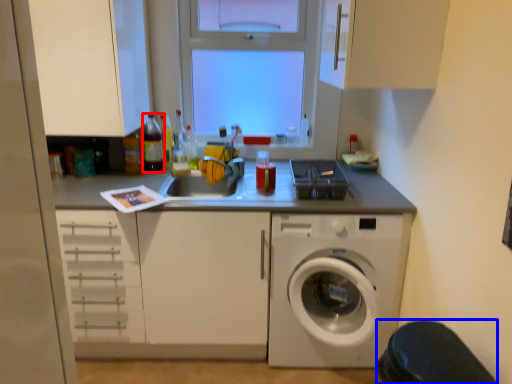
Question: Among these objects, which one is nearest to the camera, bottle (highlighted by a red box) or step stool (highlighted by a blue box)?

Choices:
 (A) bottle
 (B) step stool

Answer: (B)